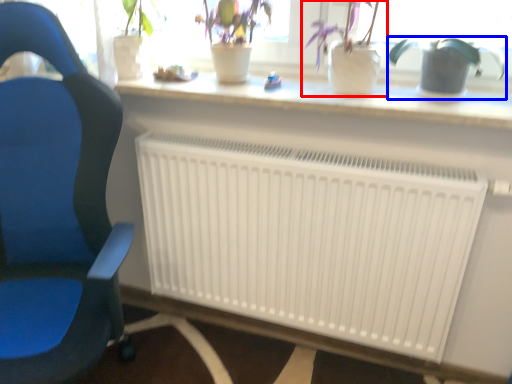
Question: Which of the following is the closest to the observer, houseplant (highlighted by a red box) or houseplant (highlighted by a blue box)?

Choices:
 (A) houseplant
 (B) houseplant

Answer: (A)